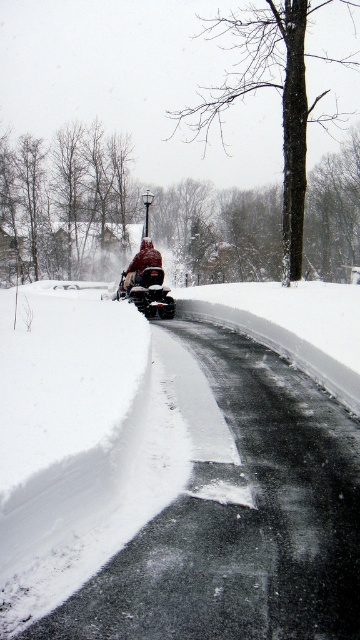
You are a delivery person needing to navigate through the snow. You see a shiny red snowmobile at center and a red knit hat at center. Which object is taller, and why?

The red knit hat at center is taller than the shiny red snowmobile at center because the snowmobile is shorter than the hat.

You are standing at the edge of the road in the snowy scene. You see two points marked on the road surface. Which point is closer to you, point (133, 280) or point (124, 280)?

Point (133, 280) is closer to you than point (124, 280).

From the picture: You are a delivery drone that needs to land on the road in this snowy scene. The landing pad must be clear of snow and large enough to accommodate your 1.2 meter by 1.2 meter landing pad. Given the description of the road and the shiny red snowmobile at center, can you find a suitable spot to land?

The road has cleared dark pavement between the snowbanks, so there is likely enough space to land the drone. The shiny red snowmobile at center is positioned at point (x=146, y=292), so avoid that area and choose a clear section of the road away from the snowmobile.